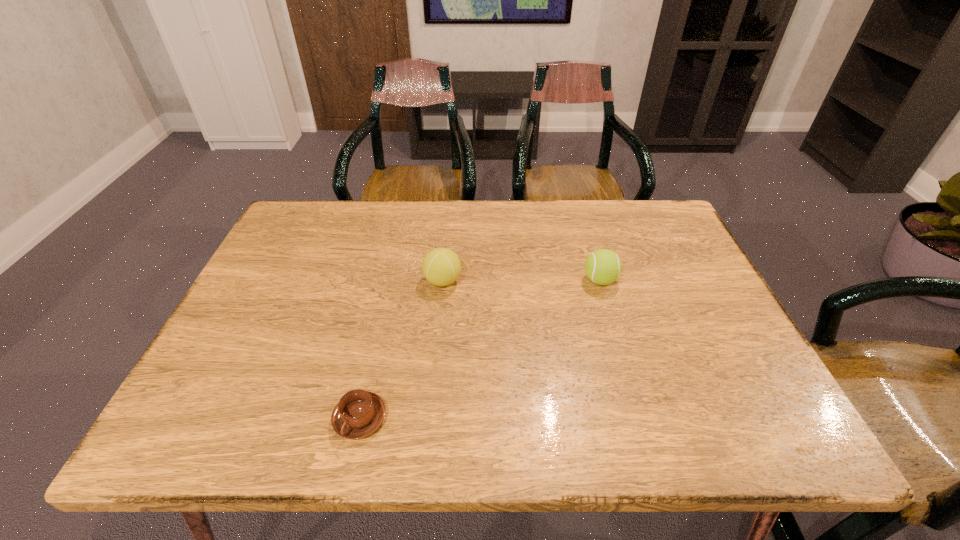
Image resolution: width=960 pixels, height=540 pixels. In the image, there is a desktop. In order to click on free region at the right edge in this screenshot , I will do `click(760, 375)`.

What are the coordinates of `vacant space at the far left corner of the desktop` in the screenshot? It's located at (284, 245).

Image resolution: width=960 pixels, height=540 pixels. What are the coordinates of `free area in between the rightmost object and the shortest object` in the screenshot? It's located at (480, 349).

Locate an element on the screen. The height and width of the screenshot is (540, 960). empty space that is in between the second object from left to right and the shortest object is located at coordinates (401, 350).

Where is `free space between the second object from right to left and the rightmost object`? The image size is (960, 540). free space between the second object from right to left and the rightmost object is located at coordinates (521, 281).

At what (x,y) coordinates should I click in order to perform the action: click on free area in between the second object from left to right and the shortest object. Please return your answer as a coordinate pair (x, y). The height and width of the screenshot is (540, 960). Looking at the image, I should click on (401, 350).

The image size is (960, 540). I want to click on empty space between the second object from left to right and the right tennis ball, so click(x=521, y=281).

Find the location of `free spot between the leftmost object and the rightmost object`. free spot between the leftmost object and the rightmost object is located at coordinates (480, 349).

The width and height of the screenshot is (960, 540). I want to click on vacant space that is in between the right tennis ball and the shortest object, so pos(480,349).

You are a GUI agent. You are given a task and a screenshot of the screen. Output one action in this format:
    pyautogui.click(x=<x>, y=<y>)
    Task: Click on the vacant area that lies between the shortest object and the right tennis ball
    This screenshot has height=540, width=960.
    Given the screenshot: What is the action you would take?
    pyautogui.click(x=480, y=349)